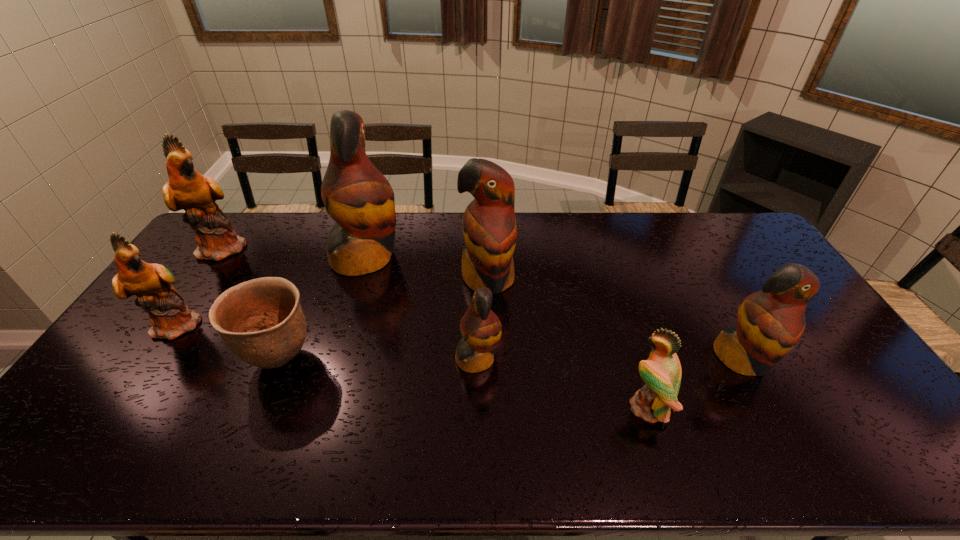
Identify the location of vacant area situated 0.140m on the left of the shortest object. (194, 359).

Find the location of a particular element. This screenshot has width=960, height=540. object that is at the far left corner is located at coordinates (187, 189).

At what (x,y) coordinates should I click in order to perform the action: click on vacant space at the far edge of the desktop. Please return your answer as a coordinate pair (x, y). This screenshot has width=960, height=540. Looking at the image, I should click on (540, 218).

This screenshot has height=540, width=960. In order to click on vacant space at the near edge of the desktop in this screenshot , I will do pyautogui.click(x=513, y=455).

This screenshot has width=960, height=540. I want to click on blank space at the left edge, so click(x=140, y=399).

At what (x,y) coordinates should I click in order to perform the action: click on vacant area at the right edge. Please return your answer as a coordinate pair (x, y). This screenshot has width=960, height=540. Looking at the image, I should click on (816, 359).

The width and height of the screenshot is (960, 540). What are the coordinates of `free space at the far left corner` in the screenshot? It's located at (242, 219).

Identify the location of free space at the near left corner. This screenshot has height=540, width=960. (41, 455).

Identify the location of free space that is in between the shortest object and the second biggest red parrot. The height and width of the screenshot is (540, 960). (384, 319).

At what (x,y) coordinates should I click in order to perform the action: click on free space between the rightmost object and the second biggest red parrot. Please return your answer as a coordinate pair (x, y). This screenshot has width=960, height=540. Looking at the image, I should click on (614, 319).